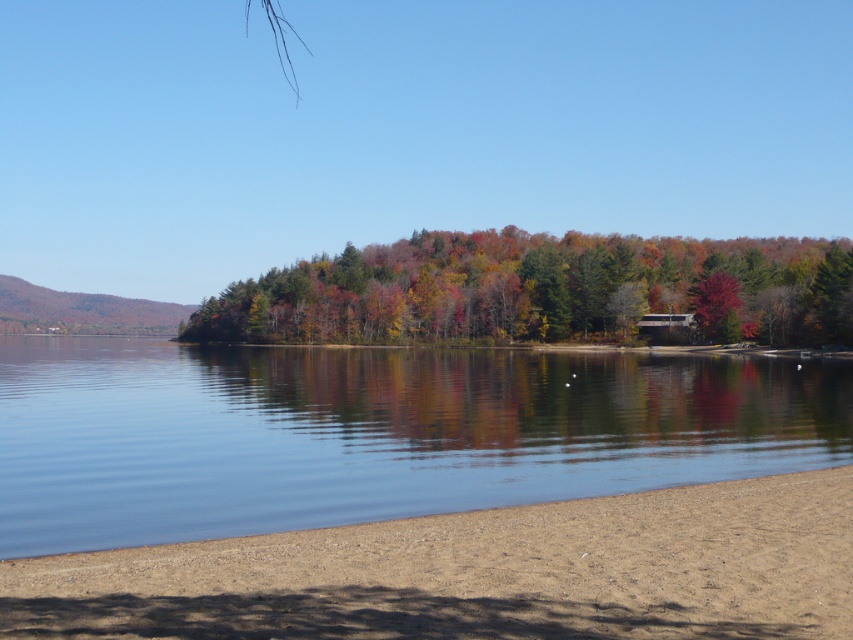
Question: Which object appears closest to the camera in this image?

Choices:
 (A) multicolored foliage at center
 (B) brown sandy beach at lower center

Answer: (B)

Question: Where is clear water at center located in relation to brown sandy beach at lower center in the image?

Choices:
 (A) right
 (B) left

Answer: (B)

Question: Where is clear water at center located in relation to multicolored foliage at center in the image?

Choices:
 (A) above
 (B) below

Answer: (B)

Question: Which object appears closest to the camera in this image?

Choices:
 (A) clear water at center
 (B) multicolored foliage at center

Answer: (A)

Question: Does brown sandy beach at lower center have a smaller size compared to multicolored foliage at center?

Choices:
 (A) yes
 (B) no

Answer: (A)

Question: Which point is closer to the camera taking this photo?

Choices:
 (A) (732, 566)
 (B) (564, 326)
 (C) (4, 451)

Answer: (A)